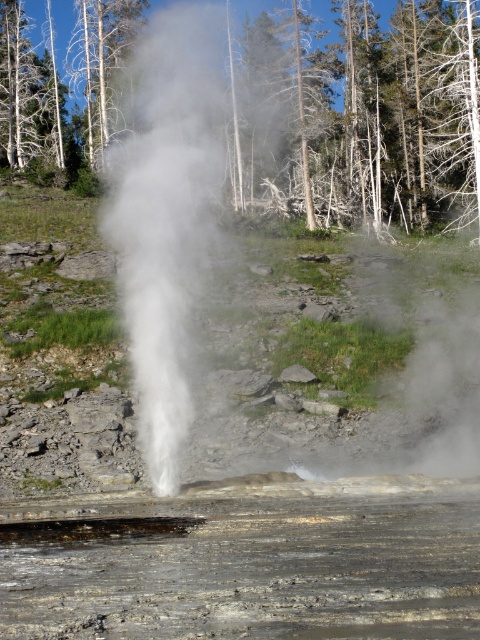
Question: Is dead wood tree at center bigger than white vapor at center?

Choices:
 (A) yes
 (B) no

Answer: (B)

Question: Among these points, which one is farthest from the camera?

Choices:
 (A) [197, 250]
 (B) [0, 77]

Answer: (B)

Question: Among these points, which one is farthest from the camera?

Choices:
 (A) (430, 28)
 (B) (190, 44)

Answer: (B)

Question: From the image, what is the correct spatial relationship of dead wood tree at center in relation to white vapor at center?

Choices:
 (A) right
 (B) left

Answer: (A)

Question: Does dead wood tree at center appear on the right side of white vapor at center?

Choices:
 (A) no
 (B) yes

Answer: (B)